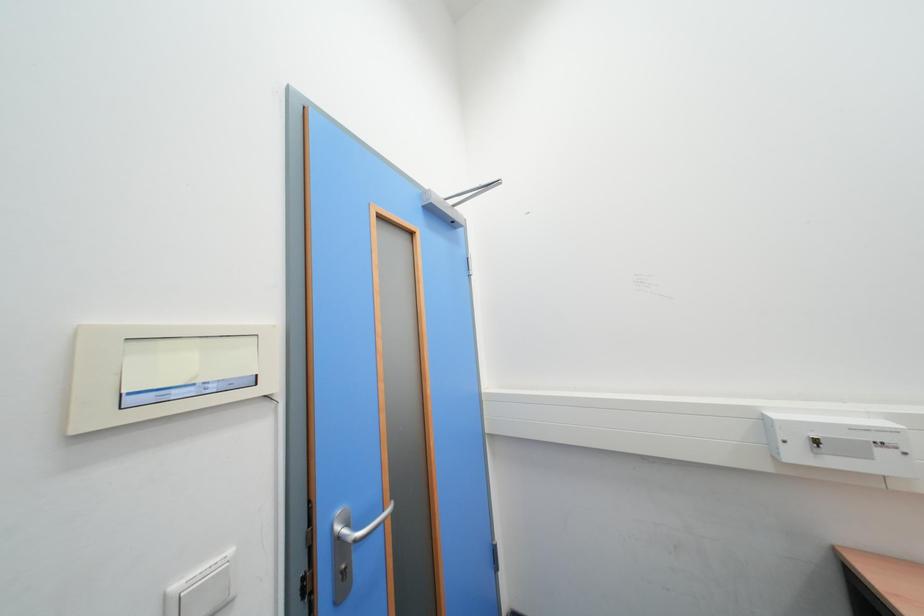
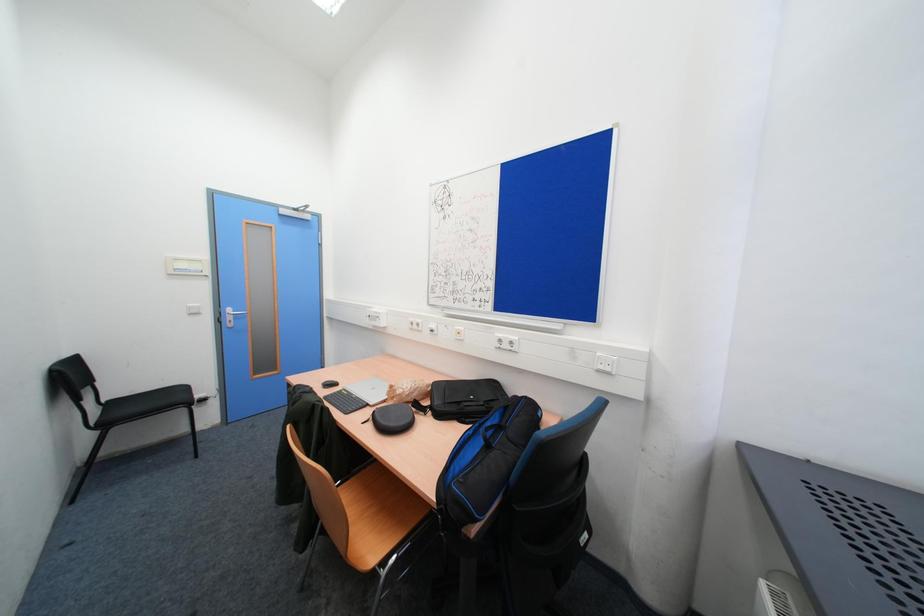
Which direction would the cameraman need to move to produce the second image?

The cameraman moved toward right, backward.